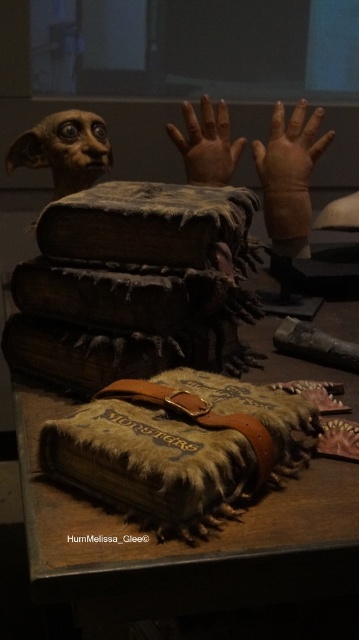
You are standing in front of the fantasy exhibit display. You see two points marked in the image. The first point is at coordinates point (182, 422), and the second point is at coordinates point (89, 122). Which point is closer to you?

Point (182, 422) is in front of point (89, 122), so it is closer to you.

Looking at this image, you are standing in front of the fantasy exhibit display. You see two points marked on the image. The first point is at coordinates point (268, 168) and the second is at point (81, 141). Which point is closer to you?

Point (268, 168) is further to the viewer than point (81, 141), so the second point is closer to you.